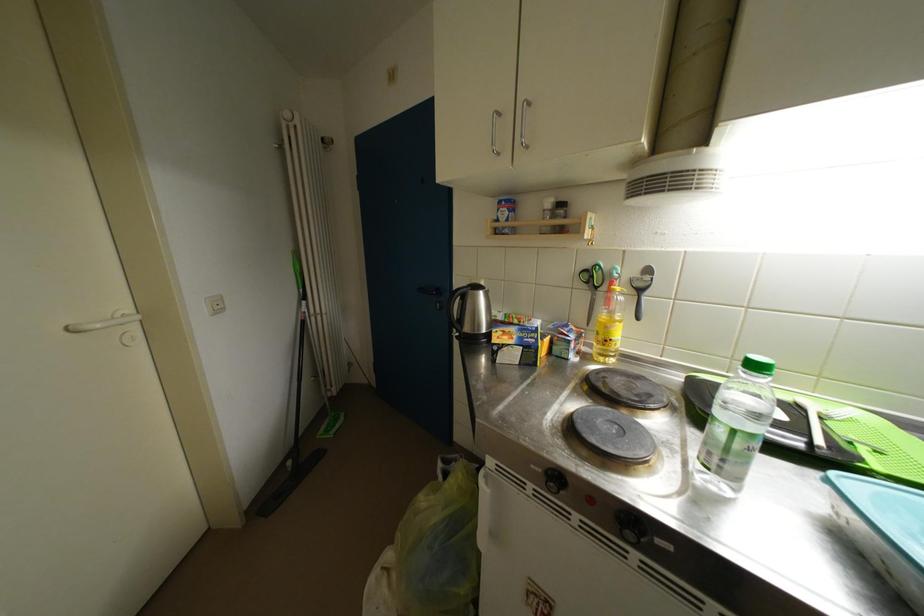
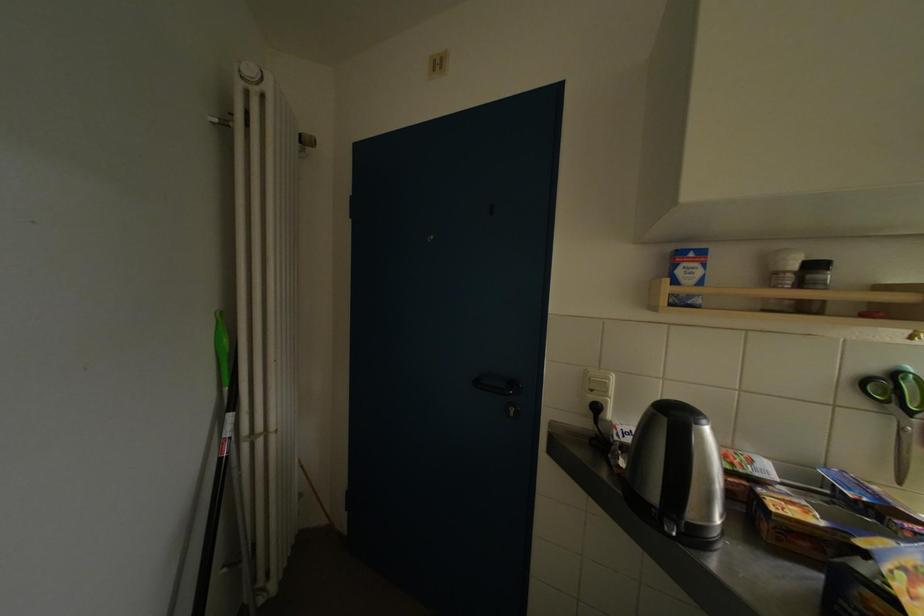
Question: The images are taken continuously from a first-person perspective. In which direction is your viewpoint rotating?

Choices:
 (A) Left
 (B) Right
 (C) Up
 (D) Down

Answer: (B)